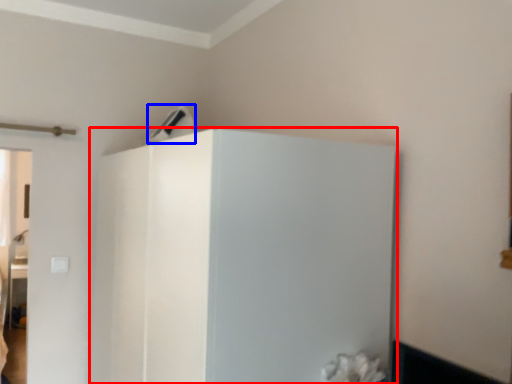
Question: Which object appears closest to the camera in this image, fridge (highlighted by a red box) or appliance (highlighted by a blue box)?

Choices:
 (A) fridge
 (B) appliance

Answer: (A)